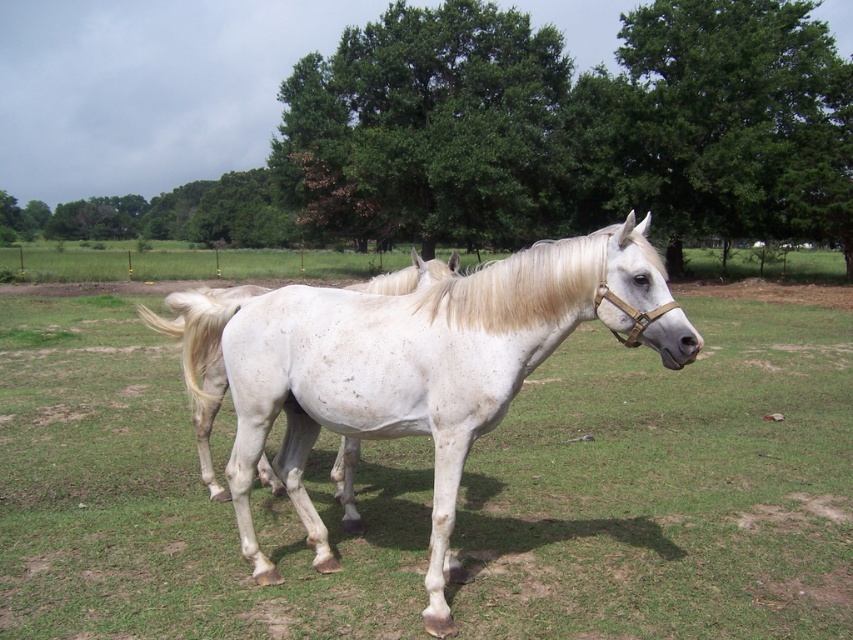
You are a photographer trying to capture both the green leafy tree at upper center and the blonde silky mane at center in your shot. Which object will appear wider in the photo?

The green leafy tree at upper center will appear wider in the photo because its width is larger than that of the blonde silky mane at center.

You are a photographer trying to capture both the green leafy tree at upper center and the blonde silky mane at center in your shot. Since you want to emphasize the tree, which object should you focus on first and why?

You should focus on the green leafy tree at upper center first because it has a larger size compared to the blonde silky mane at center, making it the more prominent subject in the scene.